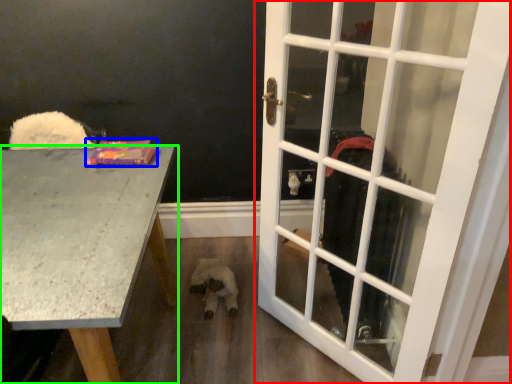
Question: Based on their relative distances, which object is farther from door (highlighted by a red box)? Choose from book (highlighted by a blue box) and desk (highlighted by a green box).

Choices:
 (A) book
 (B) desk

Answer: (A)